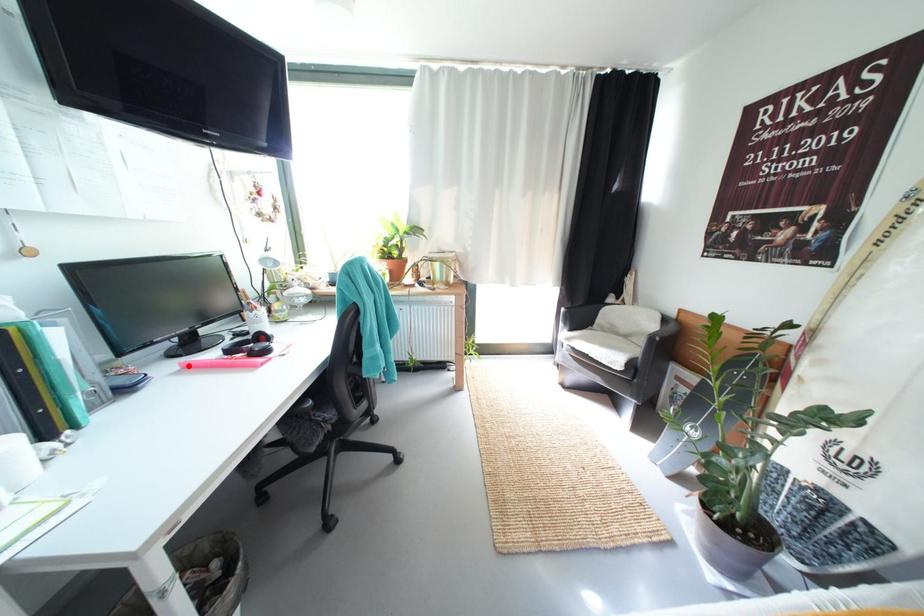
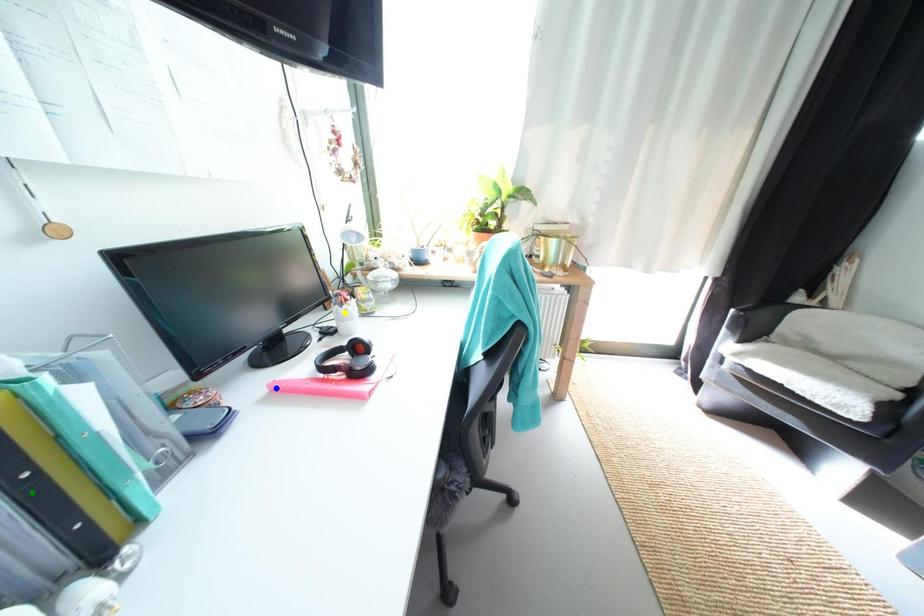
Question: I am providing you with two images of the same scene from different viewpoints. A red point is marked on the first image. You are given multiple points on the second image. Which point in image 2 is actually the same real-world point as the red point in image 1?

Choices:
 (A) yellow point
 (B) blue point
 (C) green point

Answer: (B)